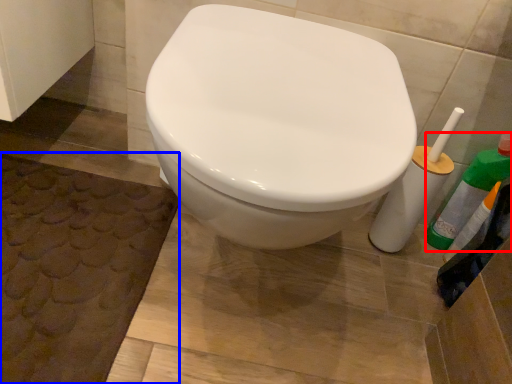
Question: Which object appears farthest to the camera in this image, cleaning product (highlighted by a red box) or bath mat (highlighted by a blue box)?

Choices:
 (A) cleaning product
 (B) bath mat

Answer: (A)